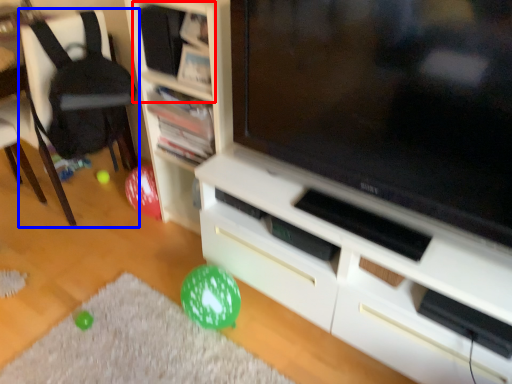
Question: Among these objects, which one is farthest to the camera, shelf (highlighted by a red box) or chair (highlighted by a blue box)?

Choices:
 (A) shelf
 (B) chair

Answer: (B)